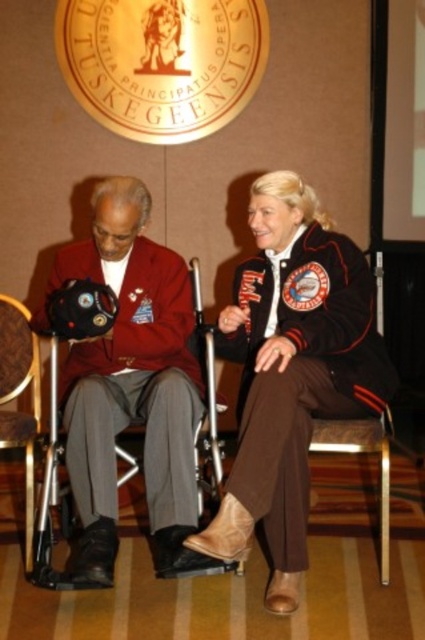
Question: Which point is closer to the camera?

Choices:
 (A) brown leather chair at lower left
 (B) matte black helmet at center

Answer: (B)

Question: Does matte black helmet at center appear on the left side of brown leather chair at lower left?

Choices:
 (A) yes
 (B) no

Answer: (B)

Question: Does matte black helmet at center appear under brown leather chair at lower left?

Choices:
 (A) no
 (B) yes

Answer: (A)

Question: Based on their relative distances, which object is farther from the brown leather chair at lower left?

Choices:
 (A) matte black helmet at center
 (B) matte black jacket at center

Answer: (B)

Question: Among these objects, which one is nearest to the camera?

Choices:
 (A) matte black helmet at center
 (B) matte black jacket at center
 (C) brown leather chair at lower left

Answer: (B)

Question: Does matte black helmet at center come in front of brown leather chair at lower left?

Choices:
 (A) no
 (B) yes

Answer: (B)